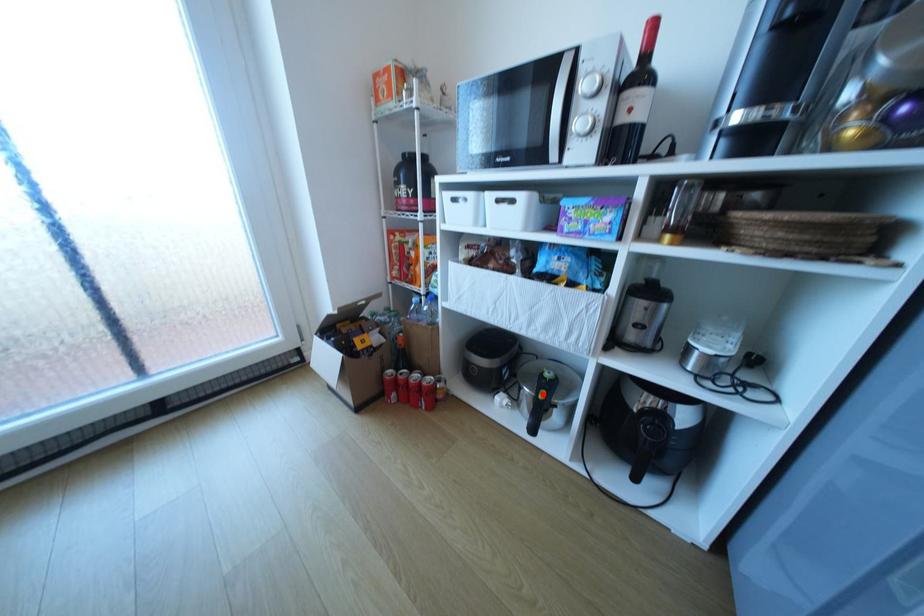
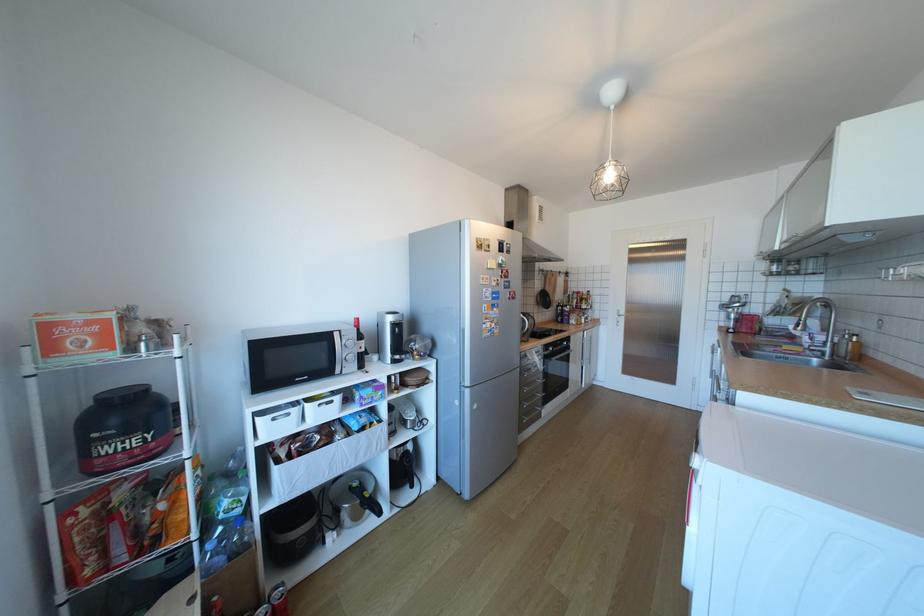
Locate, in the second image, the point that corresponds to the highlighted location in the first image.

(369, 501)